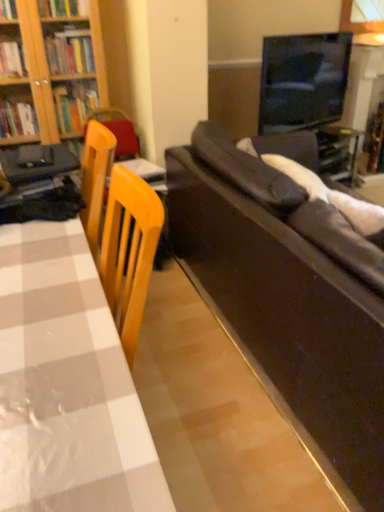
Question: Is the depth of leather couch at right less than that of white checkered table at left?

Choices:
 (A) no
 (B) yes

Answer: (A)

Question: From a real-world perspective, does leather couch at right stand above white checkered table at left?

Choices:
 (A) no
 (B) yes

Answer: (A)

Question: Are leather couch at right and white checkered table at left located far from each other?

Choices:
 (A) no
 (B) yes

Answer: (A)

Question: Considering the relative sizes of leather couch at right and white checkered table at left in the image provided, is leather couch at right taller than white checkered table at left?

Choices:
 (A) no
 (B) yes

Answer: (A)

Question: Considering the relative positions of leather couch at right and white checkered table at left in the image provided, is leather couch at right to the left of white checkered table at left from the viewer's perspective?

Choices:
 (A) no
 (B) yes

Answer: (A)

Question: Is leather couch at right in contact with white checkered table at left?

Choices:
 (A) no
 (B) yes

Answer: (A)

Question: Is white checkered table at left directly adjacent to leather couch at right?

Choices:
 (A) no
 (B) yes

Answer: (A)

Question: Is white checkered table at left at the right side of leather couch at right?

Choices:
 (A) yes
 (B) no

Answer: (B)

Question: Does white checkered table at left turn towards leather couch at right?

Choices:
 (A) no
 (B) yes

Answer: (A)

Question: Does white checkered table at left have a lesser height compared to leather couch at right?

Choices:
 (A) yes
 (B) no

Answer: (B)

Question: Considering the relative sizes of white checkered table at left and leather couch at right in the image provided, is white checkered table at left thinner than leather couch at right?

Choices:
 (A) yes
 (B) no

Answer: (A)

Question: Is leather couch at right surrounded by white checkered table at left?

Choices:
 (A) no
 (B) yes

Answer: (A)

Question: Considering their positions, is leather couch at right located in front of or behind white checkered table at left?

Choices:
 (A) front
 (B) behind

Answer: (B)